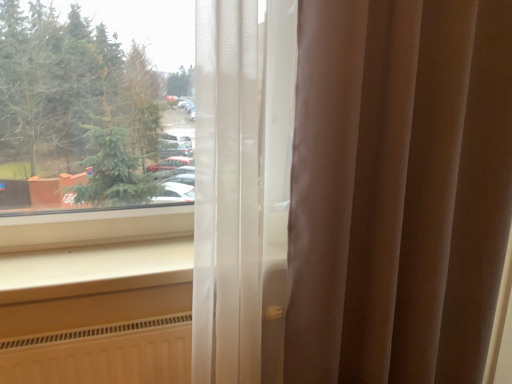
Locate an element on the screen. The width and height of the screenshot is (512, 384). sheer white curtain at center is located at coordinates (350, 189).

Describe the element at coordinates (350, 189) in the screenshot. I see `sheer white curtain at center` at that location.

Describe the element at coordinates (94, 269) in the screenshot. I see `white smooth window sill at lower left` at that location.

You are a GUI agent. You are given a task and a screenshot of the screen. Output one action in this format:
    pyautogui.click(x=<x>, y=<y>)
    Task: Click on the white smooth window sill at lower left
    This screenshot has width=512, height=384.
    Given the screenshot: What is the action you would take?
    pyautogui.click(x=94, y=269)

At what (x,y) coordinates should I click in order to perform the action: click on sheer white curtain at center. Please return your answer as a coordinate pair (x, y). Looking at the image, I should click on (350, 189).

Considering the positions of objects sheer white curtain at center and white smooth window sill at lower left in the image provided, who is more to the left, sheer white curtain at center or white smooth window sill at lower left?

Positioned to the left is white smooth window sill at lower left.

Which is in front, sheer white curtain at center or white smooth window sill at lower left?

sheer white curtain at center is in front.

Considering the positions of point (409, 298) and point (59, 270), is point (409, 298) closer or farther from the camera than point (59, 270)?

Clearly, point (409, 298) is more distant from the camera than point (59, 270).

From the image's perspective, is sheer white curtain at center below white smooth window sill at lower left?

No.

From a real-world perspective, which is physically below, sheer white curtain at center or white smooth window sill at lower left?

From a 3D spatial view, white smooth window sill at lower left is below.

Does sheer white curtain at center have a greater width compared to white smooth window sill at lower left?

In fact, sheer white curtain at center might be narrower than white smooth window sill at lower left.

Considering the sizes of sheer white curtain at center and white smooth window sill at lower left in the image, is sheer white curtain at center taller or shorter than white smooth window sill at lower left?

In the image, sheer white curtain at center appears to be taller than white smooth window sill at lower left.

Looking at the image, does sheer white curtain at center seem bigger or smaller compared to white smooth window sill at lower left?

Clearly, sheer white curtain at center is larger in size than white smooth window sill at lower left.

Can white smooth window sill at lower left be found inside sheer white curtain at center?

No, sheer white curtain at center does not contain white smooth window sill at lower left.

Is sheer white curtain at center far away from white smooth window sill at lower left?

sheer white curtain at center is near white smooth window sill at lower left, not far away.

Is sheer white curtain at center facing away from white smooth window sill at lower left?

Correct, sheer white curtain at center is looking away from white smooth window sill at lower left.

Can you tell me how much sheer white curtain at center and white smooth window sill at lower left differ in facing direction?

sheer white curtain at center and white smooth window sill at lower left are facing 1.15 degrees away from each other.

Locate an element on the screen. Image resolution: width=512 pixels, height=384 pixels. window sill below the sheer white curtain at center (from the image's perspective) is located at coordinates (94, 269).

Looking at this image, which is more to the left, white smooth window sill at lower left or sheer white curtain at center?

Positioned to the left is white smooth window sill at lower left.

Who is more distant, white smooth window sill at lower left or sheer white curtain at center?

Positioned behind is white smooth window sill at lower left.

Which is in front, point (46, 280) or point (291, 133)?

The point (46, 280) is closer to the camera.

From the image's perspective, is white smooth window sill at lower left positioned above or below sheer white curtain at center?

white smooth window sill at lower left is situated lower than sheer white curtain at center in the image.

From a real-world perspective, which is physically below, white smooth window sill at lower left or sheer white curtain at center?

From a 3D spatial view, white smooth window sill at lower left is below.

Which of these two, white smooth window sill at lower left or sheer white curtain at center, is wider?

Wider between the two is white smooth window sill at lower left.

Consider the image. Considering the relative sizes of white smooth window sill at lower left and sheer white curtain at center in the image provided, is white smooth window sill at lower left shorter than sheer white curtain at center?

Yes.

Can you confirm if white smooth window sill at lower left is smaller than sheer white curtain at center?

Yes, white smooth window sill at lower left is smaller than sheer white curtain at center.

Is white smooth window sill at lower left positioned beyond the bounds of sheer white curtain at center?

Yes.

Is white smooth window sill at lower left beside sheer white curtain at center?

No, white smooth window sill at lower left is not making contact with sheer white curtain at center.

Is white smooth window sill at lower left turned away from sheer white curtain at center?

No, white smooth window sill at lower left is not facing away from sheer white curtain at center.

Find the location of `curtain above the white smooth window sill at lower left (from the image's perspective)`. curtain above the white smooth window sill at lower left (from the image's perspective) is located at coordinates click(x=350, y=189).

You are a GUI agent. You are given a task and a screenshot of the screen. Output one action in this format:
    pyautogui.click(x=<x>, y=<y>)
    Task: Click on the curtain that appears above the white smooth window sill at lower left (from a real-world perspective)
    
    Given the screenshot: What is the action you would take?
    pyautogui.click(x=350, y=189)

The width and height of the screenshot is (512, 384). I want to click on window sill lying below the sheer white curtain at center (from the image's perspective), so click(x=94, y=269).